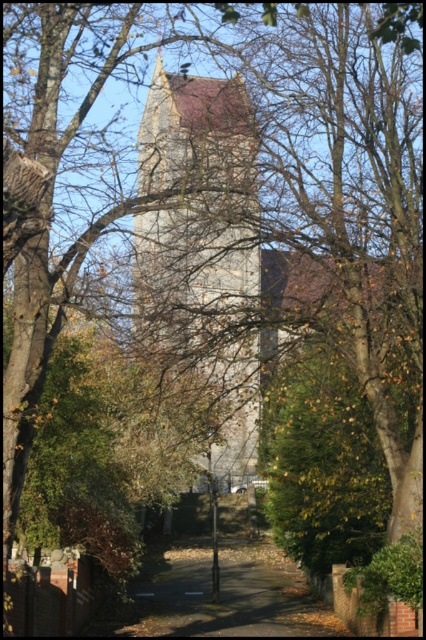
Question: Considering the relative positions of stone tower at center and dirt path at center in the image provided, where is stone tower at center located with respect to dirt path at center?

Choices:
 (A) above
 (B) below

Answer: (A)

Question: Can you confirm if stone tower at center is thinner than dirt path at center?

Choices:
 (A) no
 (B) yes

Answer: (B)

Question: Is stone tower at center bigger than dirt path at center?

Choices:
 (A) no
 (B) yes

Answer: (B)

Question: Which point is closer to the camera taking this photo?

Choices:
 (A) (224, 273)
 (B) (164, 582)

Answer: (A)